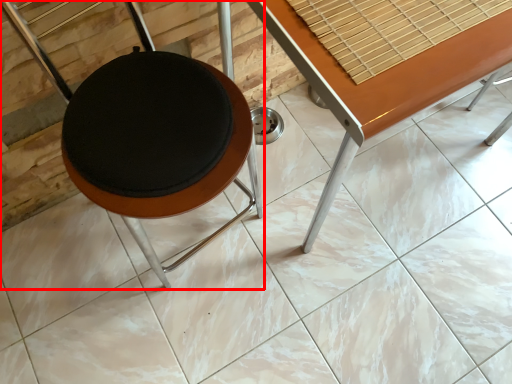
Question: Observing the image, what is the correct spatial positioning of furniture (annotated by the red box) in reference to table?

Choices:
 (A) left
 (B) right

Answer: (A)